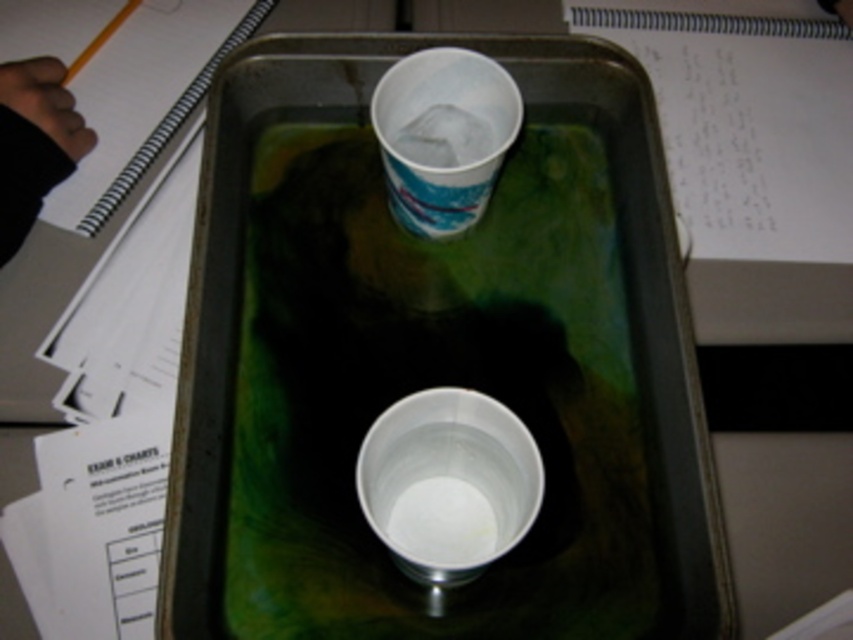
You are standing in front of the desk with the rectangular metal tray. There are two points marked on the tray at coordinates point (x=601, y=422) and point (x=192, y=99). If you want to place a small sticker on the point that is closer to you, which coordinate should you choose?

Point (x=601, y=422) is closer to the viewer than point (x=192, y=99), so you should choose point (x=601, y=422) to place the sticker.

You are a student conducting an experiment and need to place a ruler next to the white paper cup at upper center and the white spiral notebook at upper left. Which object will the ruler appear longer when placed next to it?

The ruler will appear longer when placed next to the white paper cup at upper center because it is thinner than the white spiral notebook at upper left.